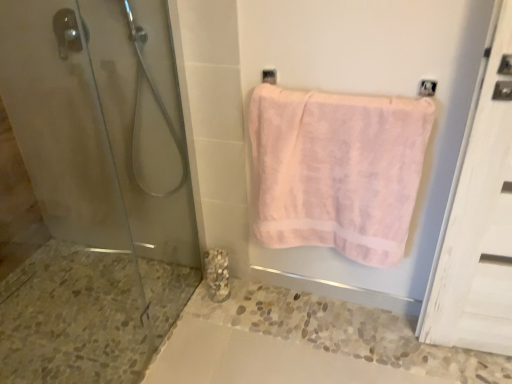
You are a GUI agent. You are given a task and a screenshot of the screen. Output one action in this format:
    pyautogui.click(x=<x>, y=<y>)
    Task: Click on the empty space that is in between marble textured at lower left and transparent glass shower door at left
    This screenshot has height=384, width=512.
    Given the screenshot: What is the action you would take?
    pyautogui.click(x=196, y=334)